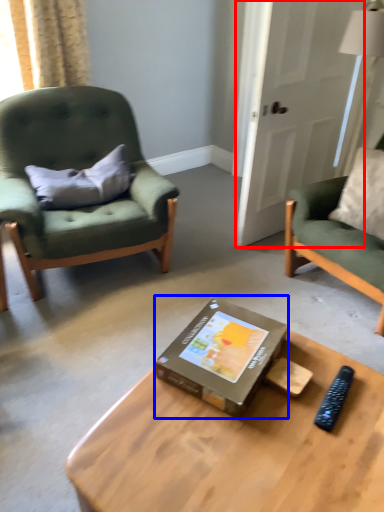
Question: Among these objects, which one is nearest to the camera, glass door (highlighted by a red box) or box (highlighted by a blue box)?

Choices:
 (A) glass door
 (B) box

Answer: (B)